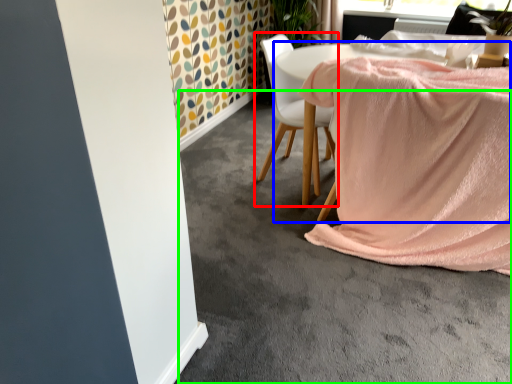
Question: Which is nearer to the chair (highlighted by a red box)? table (highlighted by a blue box) or concrete (highlighted by a green box).

Choices:
 (A) table
 (B) concrete

Answer: (A)